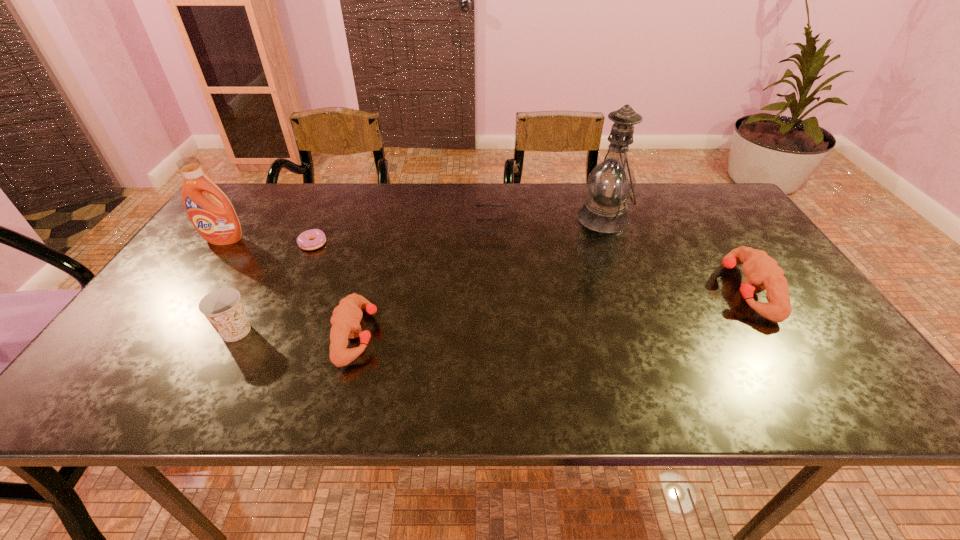
This screenshot has width=960, height=540. In order to click on detergent in this screenshot , I will do `click(217, 222)`.

Find the location of a particular element. The width and height of the screenshot is (960, 540). the leftmost object is located at coordinates (217, 222).

Identify the location of Dixie cup. The height and width of the screenshot is (540, 960). (223, 308).

You are a GUI agent. You are given a task and a screenshot of the screen. Output one action in this format:
    pyautogui.click(x=<x>, y=<y>)
    Task: Click on the vacant space situated with the gloves of the fourth object from left to right facing forward
    This screenshot has width=960, height=540.
    Given the screenshot: What is the action you would take?
    pyautogui.click(x=515, y=335)

This screenshot has height=540, width=960. In order to click on vacant area located 0.180m with the gloves of the rightmost object facing forward in this screenshot , I will do `click(652, 291)`.

Identify the location of free space located 0.210m with the gloves of the rightmost object facing forward. (640, 291).

Where is `free space located 0.400m with the gloves of the rightmost object facing forward`? The height and width of the screenshot is (540, 960). free space located 0.400m with the gloves of the rightmost object facing forward is located at coordinates (564, 291).

This screenshot has height=540, width=960. Find the location of `vacant space located on the front of the third object from left to right`. vacant space located on the front of the third object from left to right is located at coordinates [287, 304].

Image resolution: width=960 pixels, height=540 pixels. What are the coordinates of `vacant space located on the right of the second object from right to left` in the screenshot? It's located at (656, 218).

You are a GUI agent. You are given a task and a screenshot of the screen. Output one action in this format:
    pyautogui.click(x=<x>, y=<y>)
    Task: Click on the vacant space located on the front-facing side of the second shortest object
    
    Given the screenshot: What is the action you would take?
    pyautogui.click(x=351, y=226)